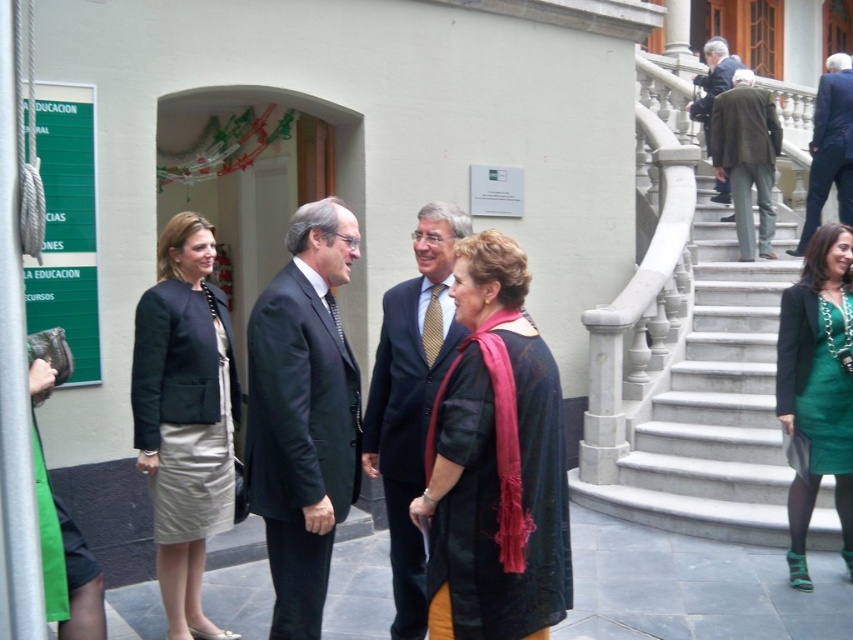
Between dark blue suit at center and green satin dress at lower right, which one has more height?

Standing taller between the two is green satin dress at lower right.

Which is above, dark blue suit at center or green satin dress at lower right?

dark blue suit at center is higher up.

This screenshot has width=853, height=640. What do you see at coordinates (410, 397) in the screenshot?
I see `dark blue suit at center` at bounding box center [410, 397].

I want to click on dark blue suit at center, so click(x=410, y=397).

Between green wool coat at upper right and blue suit at upper right, which one appears on the right side from the viewer's perspective?

Positioned to the right is blue suit at upper right.

Is point (712, 120) less distant than point (834, 72)?

That is True.

Consider the image. Measure the distance between green wool coat at upper right and camera.

A distance of 8.68 meters exists between green wool coat at upper right and camera.

At what (x,y) coordinates should I click in order to perform the action: click on green wool coat at upper right. Please return your answer as a coordinate pair (x, y). The width and height of the screenshot is (853, 640). Looking at the image, I should click on (747, 157).

Can you confirm if velvet black shawl at center is bigger than silk beige skirt at center?

Actually, velvet black shawl at center might be smaller than silk beige skirt at center.

Does velvet black shawl at center appear under silk beige skirt at center?

Actually, velvet black shawl at center is above silk beige skirt at center.

What are the coordinates of `velvet black shawl at center` in the screenshot? It's located at (495, 464).

Locate an element on the screen. velvet black shawl at center is located at coordinates (495, 464).